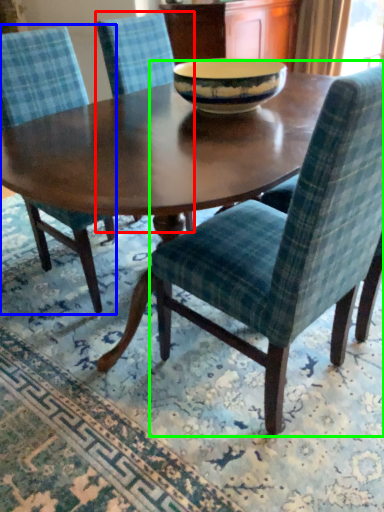
Question: Based on their relative distances, which object is nearer to chair (highlighted by a red box)? Choose from chair (highlighted by a blue box) and chair (highlighted by a green box).

Choices:
 (A) chair
 (B) chair

Answer: (A)